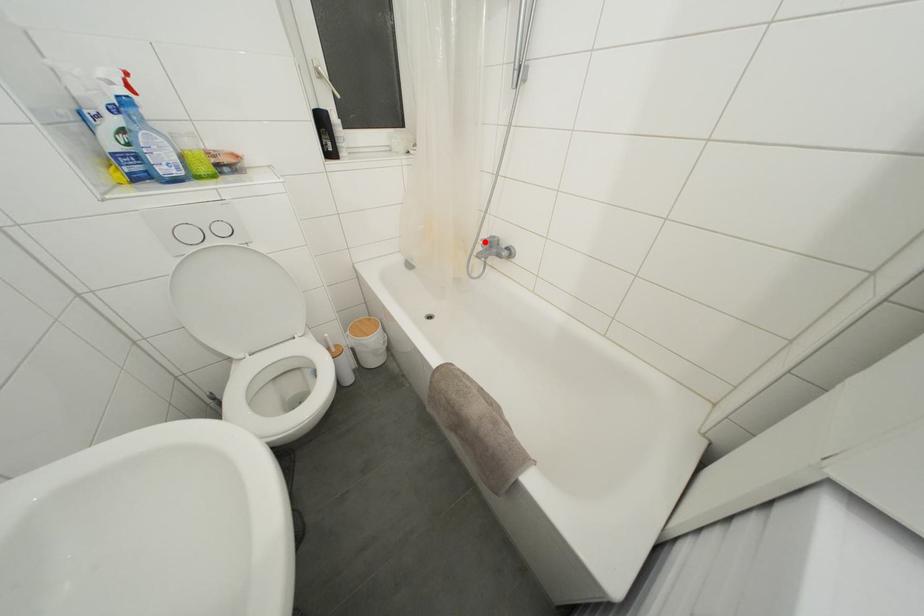
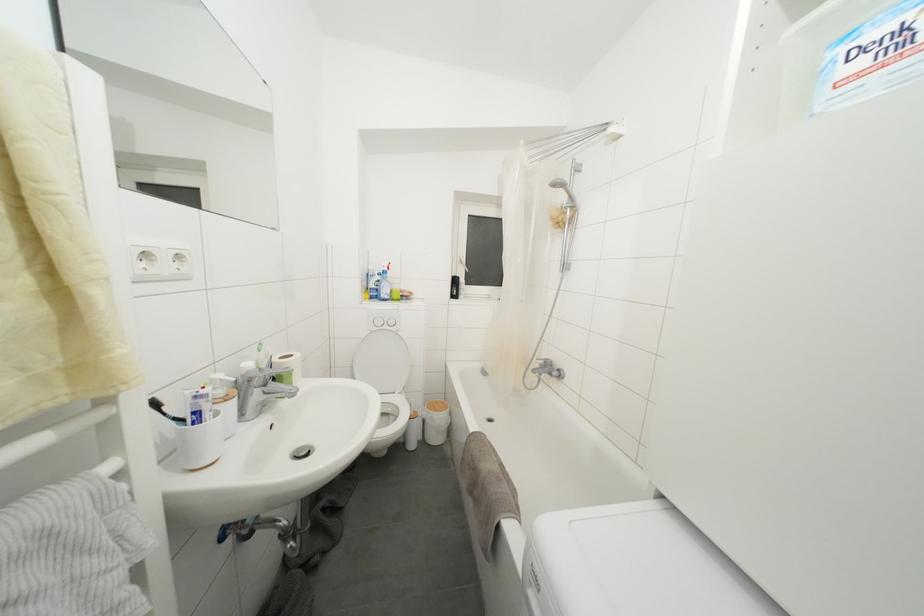
Locate, in the second image, the point that corresponds to the highlighted location in the first image.

(540, 362)